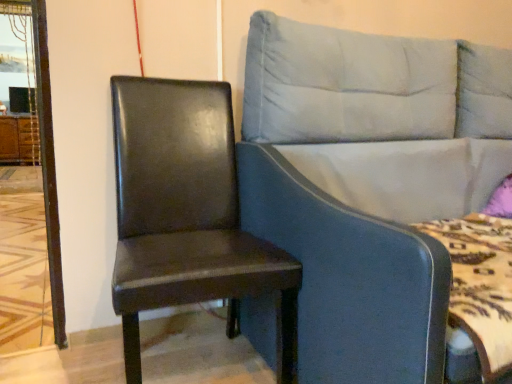
Describe the element at coordinates (187, 215) in the screenshot. Image resolution: width=512 pixels, height=384 pixels. I see `matte black chair at left` at that location.

Describe the element at coordinates (368, 183) in the screenshot. The image size is (512, 384). I see `light blue fabric studio couch at center` at that location.

This screenshot has width=512, height=384. Identify the location of matte black chair at left. (187, 215).

Considering the relative sizes of light blue fabric studio couch at center and brown wood dresser at left in the image provided, is light blue fabric studio couch at center wider than brown wood dresser at left?

Yes, light blue fabric studio couch at center is wider than brown wood dresser at left.

Measure the distance between light blue fabric studio couch at center and brown wood dresser at left.

The distance of light blue fabric studio couch at center from brown wood dresser at left is 5.46 meters.

Identify the location of studio couch below the brown wood dresser at left (from the image's perspective). Image resolution: width=512 pixels, height=384 pixels. (368, 183).

In the scene shown: From the image's perspective, is light blue fabric studio couch at center under brown wood dresser at left?

Yes, from the image's perspective, light blue fabric studio couch at center is below brown wood dresser at left.

Is brown wood dresser at left in contact with matte black chair at left?

No, brown wood dresser at left is not beside matte black chair at left.

Considering the positions of points (15, 155) and (266, 259), is point (15, 155) farther from camera compared to point (266, 259)?

Yes.

Considering the sizes of objects brown wood dresser at left and matte black chair at left in the image provided, who is shorter, brown wood dresser at left or matte black chair at left?

brown wood dresser at left is shorter.

Is brown wood dresser at left turned away from matte black chair at left?

No, brown wood dresser at left's orientation is not away from matte black chair at left.

Is matte black chair at left beside brown wood dresser at left?

matte black chair at left and brown wood dresser at left are not in contact.

From the picture: Considering the relative positions of matte black chair at left and brown wood dresser at left in the image provided, is matte black chair at left to the left or to the right of brown wood dresser at left?

matte black chair at left is positioned on brown wood dresser at left's right side.

How different are the orientations of matte black chair at left and brown wood dresser at left in degrees?

The angular difference between matte black chair at left and brown wood dresser at left is 3.34 degrees.

Considering the points (160, 185) and (12, 141), which point is behind, point (160, 185) or point (12, 141)?

The point (12, 141) is farther.

Is light blue fabric studio couch at center looking in the opposite direction of matte black chair at left?

No, light blue fabric studio couch at center is not facing the opposite direction of matte black chair at left.

Based on their positions, is light blue fabric studio couch at center located to the left or right of matte black chair at left?

Based on their positions, light blue fabric studio couch at center is located to the right of matte black chair at left.

In terms of height, does light blue fabric studio couch at center look taller or shorter compared to matte black chair at left?

Considering their sizes, light blue fabric studio couch at center has more height than matte black chair at left.

From the picture: How many degrees apart are the facing directions of brown wood dresser at left and light blue fabric studio couch at center?

They differ by 0.752 degrees in their facing directions.

From a real-world perspective, is brown wood dresser at left positioned over light blue fabric studio couch at center based on gravity?

Incorrect, from a real-world perspective, brown wood dresser at left is lower than light blue fabric studio couch at center.

Which point is more forward, (2, 152) or (362, 109)?

The point (362, 109) is closer to the camera.

Considering the sizes of objects brown wood dresser at left and light blue fabric studio couch at center in the image provided, who is bigger, brown wood dresser at left or light blue fabric studio couch at center?

light blue fabric studio couch at center.

Is matte black chair at left aimed at light blue fabric studio couch at center?

No.

From a real-world perspective, who is located higher, matte black chair at left or light blue fabric studio couch at center?

light blue fabric studio couch at center is physically above.

Is the depth of matte black chair at left less than that of light blue fabric studio couch at center?

No, matte black chair at left is further to the viewer.

Measure the distance from matte black chair at left to light blue fabric studio couch at center.

matte black chair at left and light blue fabric studio couch at center are 14.57 inches apart from each other.

Find the location of `studio couch on the right of brown wood dresser at left`. studio couch on the right of brown wood dresser at left is located at coordinates (368, 183).

Locate an element on the screen. The height and width of the screenshot is (384, 512). chair that is in front of the brown wood dresser at left is located at coordinates (187, 215).

Looking at the image, which one is located further to brown wood dresser at left, light blue fabric studio couch at center or matte black chair at left?

light blue fabric studio couch at center is positioned further to the anchor brown wood dresser at left.

Considering their positions, is matte black chair at left positioned closer to light blue fabric studio couch at center than brown wood dresser at left?

matte black chair at left is positioned closer to the anchor light blue fabric studio couch at center.

From the image, which object appears to be farther from brown wood dresser at left, matte black chair at left or light blue fabric studio couch at center?

The object further to brown wood dresser at left is light blue fabric studio couch at center.

Which object lies further to the anchor point matte black chair at left, brown wood dresser at left or light blue fabric studio couch at center?

Among the two, brown wood dresser at left is located further to matte black chair at left.

From the image, which object appears to be farther from matte black chair at left, light blue fabric studio couch at center or brown wood dresser at left?

Based on the image, brown wood dresser at left appears to be further to matte black chair at left.

Estimate the real-world distances between objects in this image. Which object is further from light blue fabric studio couch at center, brown wood dresser at left or matte black chair at left?

The object further to light blue fabric studio couch at center is brown wood dresser at left.

You are a GUI agent. You are given a task and a screenshot of the screen. Output one action in this format:
    pyautogui.click(x=<x>, y=<y>)
    Task: Click on the chair positioned between light blue fabric studio couch at center and brown wood dresser at left from near to far
    
    Given the screenshot: What is the action you would take?
    pyautogui.click(x=187, y=215)